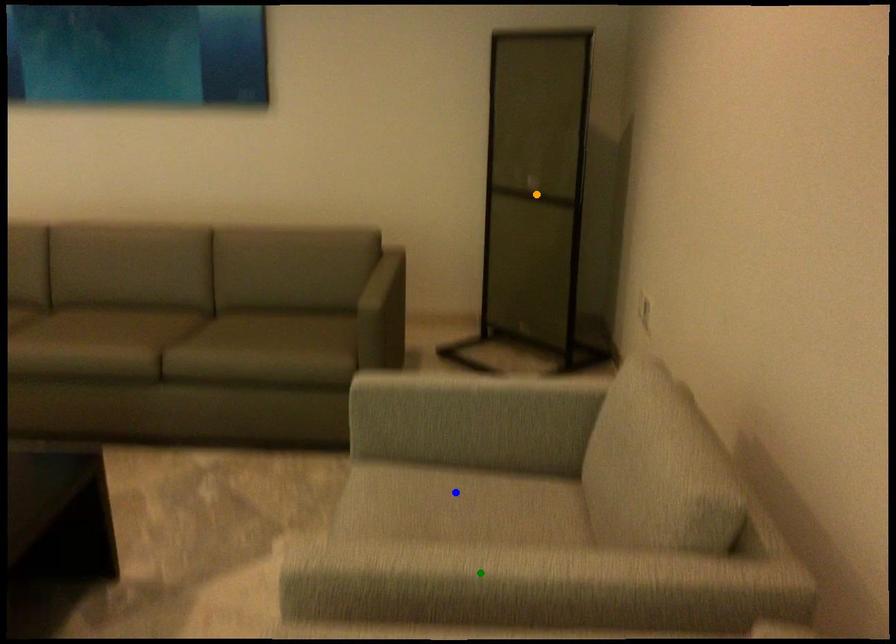
Order these from nearest to farthest:
green point | blue point | orange point

1. green point
2. blue point
3. orange point